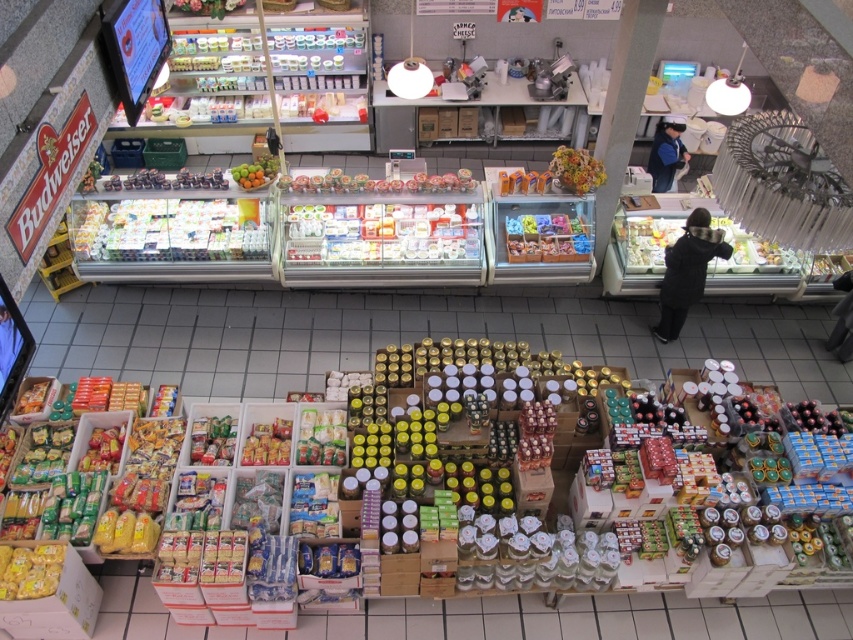
Is black woolen jacket at center wider than multicolored floral arrangement at center?

Yes, black woolen jacket at center is wider than multicolored floral arrangement at center.

Does point (668, 244) come farther from viewer compared to point (590, 160)?

Yes, point (668, 244) is farther from viewer.

The width and height of the screenshot is (853, 640). I want to click on black woolen jacket at center, so click(x=686, y=272).

In the scene shown: Does blue fabric jacket at right have a lesser height compared to green matte fruit at center?

No, blue fabric jacket at right is not shorter than green matte fruit at center.

Is blue fabric jacket at right below green matte fruit at center?

Actually, blue fabric jacket at right is above green matte fruit at center.

I want to click on blue fabric jacket at right, so click(x=666, y=154).

Who is more distant from viewer, (x=675, y=259) or (x=236, y=176)?

Point (x=236, y=176)

Does black woolen jacket at center have a greater width compared to green matte fruit at center?

Yes.

Which is in front, point (724, 259) or point (258, 180)?

Positioned in front is point (724, 259).

The width and height of the screenshot is (853, 640). I want to click on black woolen jacket at center, so click(x=686, y=272).